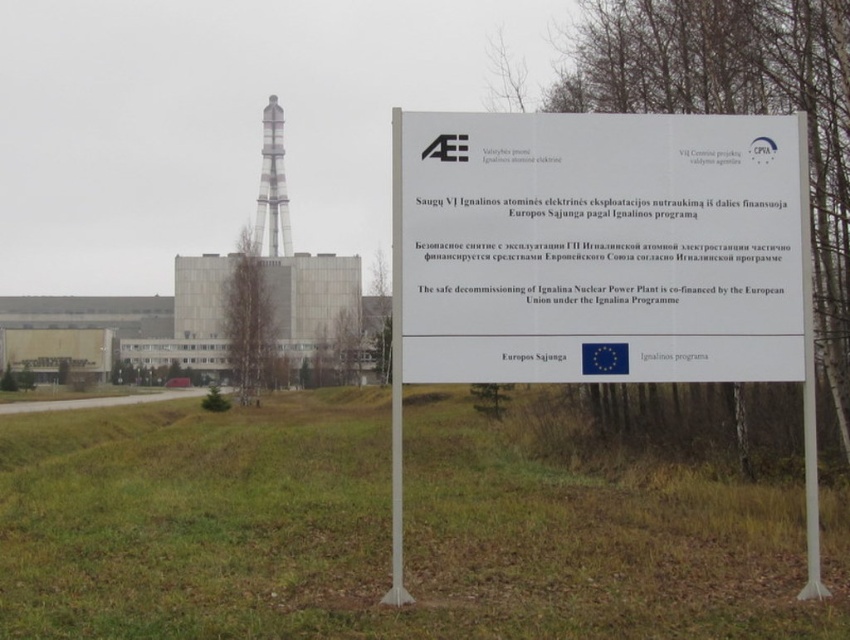
You are standing in front of the signboard and notice the green grass at center and the white metallic pole at center. Which one is wider?

The green grass at center is wider than the white metallic pole at center.